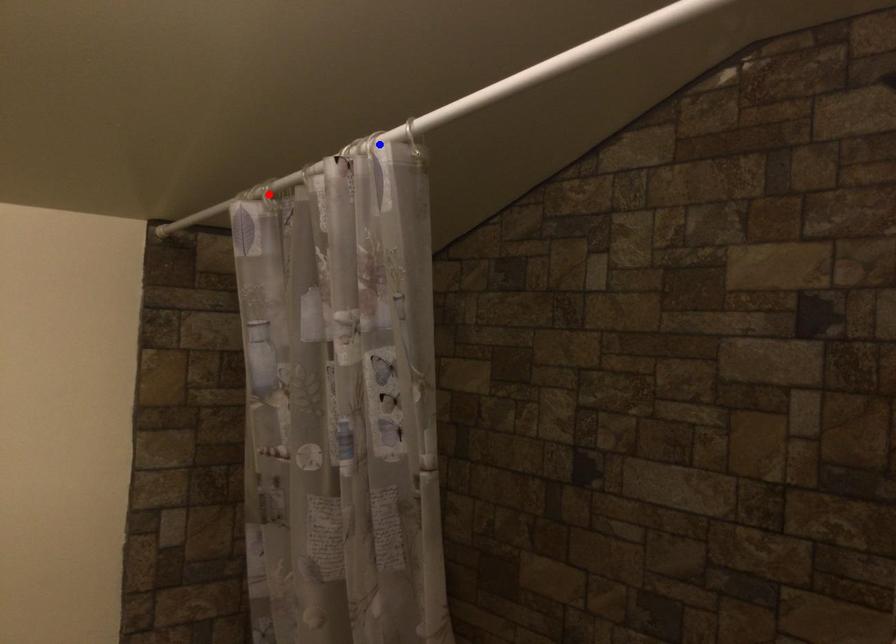
Question: Which of the two points in the image is closer to the camera?

Choices:
 (A) Blue point is closer.
 (B) Red point is closer.

Answer: (A)